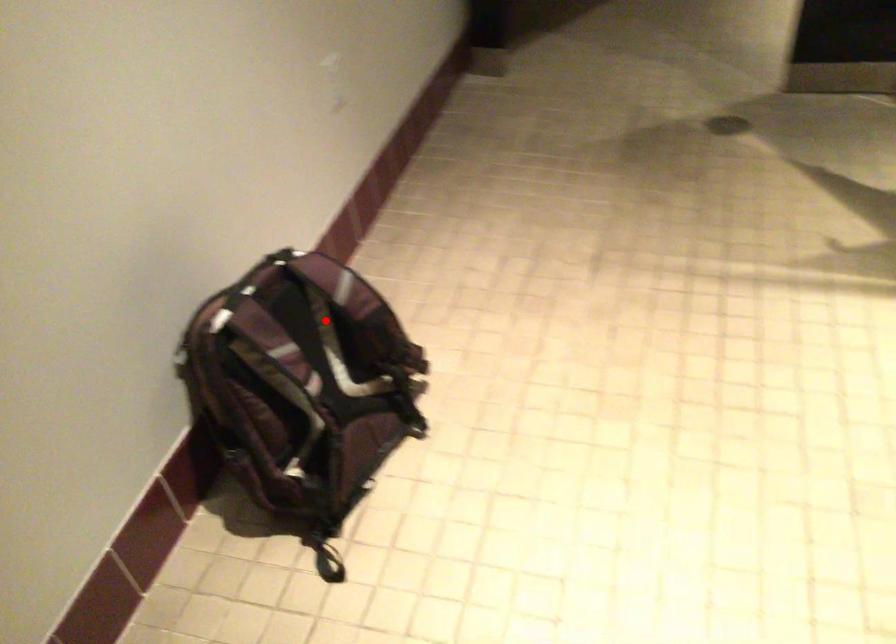
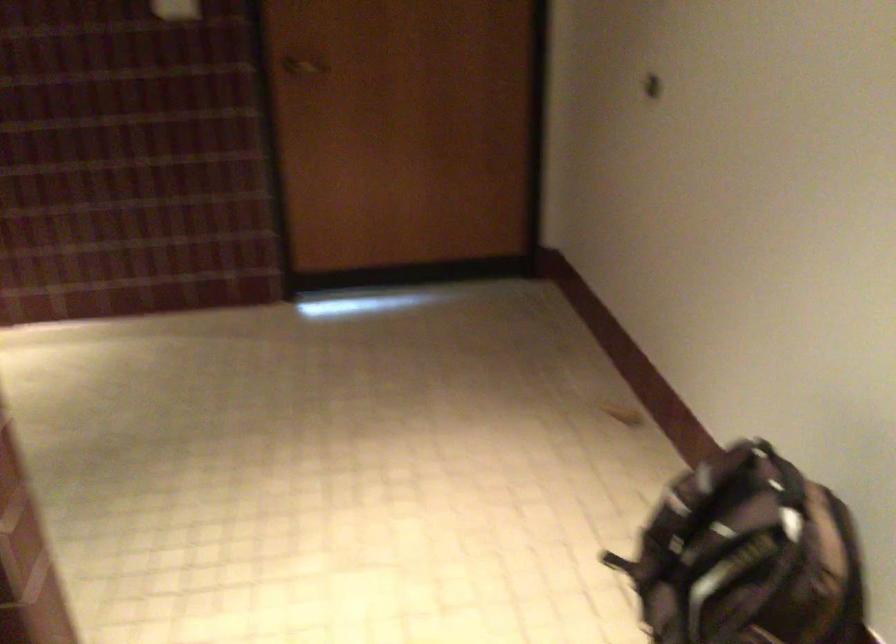
Locate, in the second image, the point that corresponds to the highlighted location in the first image.

(748, 556)